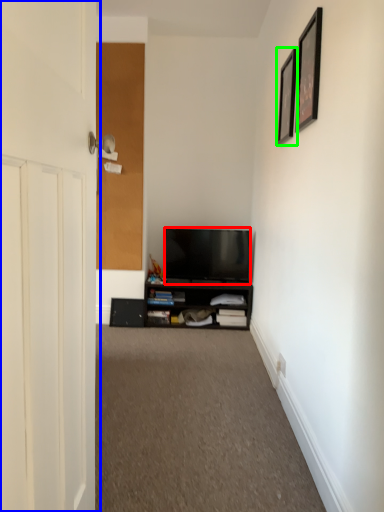
Question: Which object is positioned farthest from television (highlighted by a red box)? Select from door (highlighted by a blue box) and picture frame (highlighted by a green box).

Choices:
 (A) door
 (B) picture frame

Answer: (A)